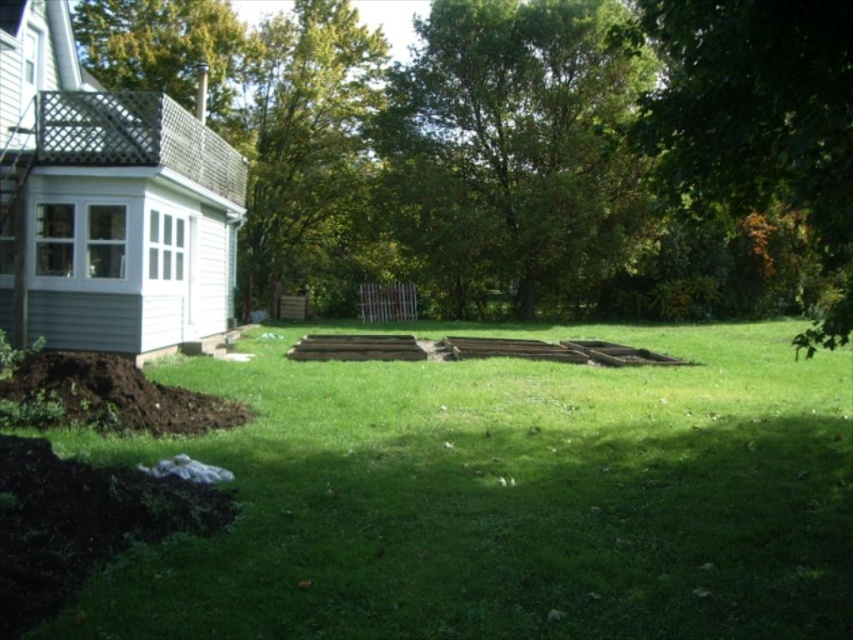
You are a gardener who wants to plant a new tree in the backyard. You notice two green leafy trees already present. Which tree is shorter, the green leafy tree at center or the green leafy tree at upper left?

The green leafy tree at center is shorter than the green leafy tree at upper left.

You are standing in the backyard and want to know how far the point at coordinates (505, 40) is from you. Can you determine the distance?

The point at coordinates (505, 40) is 29.47 meters away from you.

You are a gardener planning to plant a new shrub in the backyard. You want to ensure it gets enough sunlight. Which tree, the green leafy tree at center or the green leafy tree at upper left, might cast a smaller shadow and thus be better for the shrub?

The green leafy tree at upper left is smaller in size compared to the green leafy tree at center, so it would cast a smaller shadow. Therefore, the area near the green leafy tree at upper left might be better for the shrub to get enough sunlight.